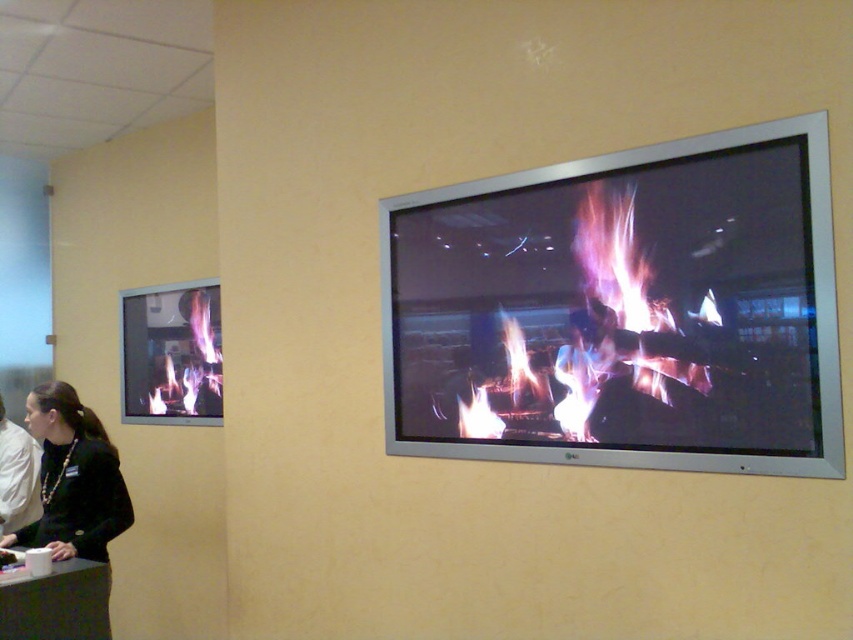
Is metallic silver screen at upper right wider than matte black fireplace at left?

Yes.

Who is shorter, metallic silver screen at upper right or matte black fireplace at left?

matte black fireplace at left is shorter.

This screenshot has width=853, height=640. Describe the element at coordinates (622, 308) in the screenshot. I see `metallic silver screen at upper right` at that location.

The height and width of the screenshot is (640, 853). I want to click on metallic silver screen at upper right, so click(x=622, y=308).

Who is more forward, (67,394) or (192,310)?

Positioned in front is point (67,394).

Can you confirm if black fabric jacket at lower left is wider than matte black fireplace at left?

In fact, black fabric jacket at lower left might be narrower than matte black fireplace at left.

This screenshot has width=853, height=640. Describe the element at coordinates (73, 480) in the screenshot. I see `black fabric jacket at lower left` at that location.

Locate an element on the screen. black fabric jacket at lower left is located at coordinates (73, 480).

Which is below, metallic silver screen at upper right or black fabric jacket at lower left?

black fabric jacket at lower left is lower down.

Can you confirm if metallic silver screen at upper right is positioned to the left of black fabric jacket at lower left?

No, metallic silver screen at upper right is not to the left of black fabric jacket at lower left.

What do you see at coordinates (622, 308) in the screenshot? I see `metallic silver screen at upper right` at bounding box center [622, 308].

Locate an element on the screen. Image resolution: width=853 pixels, height=640 pixels. metallic silver screen at upper right is located at coordinates coord(622,308).